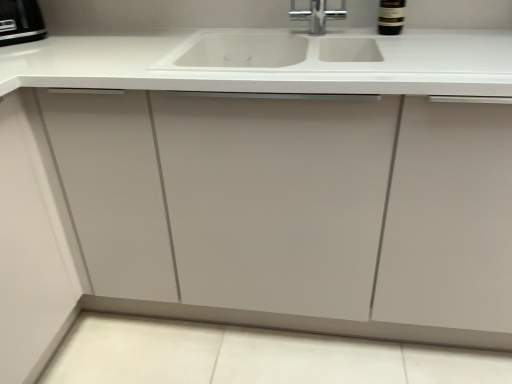
Question: From the image's perspective, is black plastic toaster at upper left located beneath white matte sink at center?

Choices:
 (A) no
 (B) yes

Answer: (A)

Question: Considering the relative positions of black plastic toaster at upper left and white matte sink at center in the image provided, is black plastic toaster at upper left to the right of white matte sink at center from the viewer's perspective?

Choices:
 (A) yes
 (B) no

Answer: (B)

Question: Is black plastic toaster at upper left at the left side of white matte sink at center?

Choices:
 (A) yes
 (B) no

Answer: (A)

Question: Is black plastic toaster at upper left oriented away from white matte sink at center?

Choices:
 (A) no
 (B) yes

Answer: (A)

Question: Is black plastic toaster at upper left in contact with white matte sink at center?

Choices:
 (A) no
 (B) yes

Answer: (A)

Question: Considering the positions of dark brown glass bottle at upper right and black plastic toaster at upper left in the image, is dark brown glass bottle at upper right taller or shorter than black plastic toaster at upper left?

Choices:
 (A) short
 (B) tall

Answer: (B)

Question: Based on their sizes in the image, would you say dark brown glass bottle at upper right is bigger or smaller than black plastic toaster at upper left?

Choices:
 (A) small
 (B) big

Answer: (A)

Question: Is dark brown glass bottle at upper right in front of or behind black plastic toaster at upper left in the image?

Choices:
 (A) behind
 (B) front

Answer: (B)

Question: In terms of width, does dark brown glass bottle at upper right look wider or thinner when compared to black plastic toaster at upper left?

Choices:
 (A) wide
 (B) thin

Answer: (B)

Question: From the image's perspective, relative to white matte sink at center, is black plastic toaster at upper left above or below?

Choices:
 (A) above
 (B) below

Answer: (A)

Question: Considering the positions of point (11, 13) and point (387, 77), is point (11, 13) closer or farther from the camera than point (387, 77)?

Choices:
 (A) closer
 (B) farther

Answer: (B)

Question: In terms of width, does black plastic toaster at upper left look wider or thinner when compared to white matte sink at center?

Choices:
 (A) thin
 (B) wide

Answer: (A)

Question: From a real-world perspective, is black plastic toaster at upper left above or below white matte sink at center?

Choices:
 (A) above
 (B) below

Answer: (A)

Question: Based on their sizes in the image, would you say dark brown glass bottle at upper right is bigger or smaller than white matte sink at center?

Choices:
 (A) small
 (B) big

Answer: (A)

Question: From the image's perspective, is dark brown glass bottle at upper right located above or below white matte sink at center?

Choices:
 (A) above
 (B) below

Answer: (A)